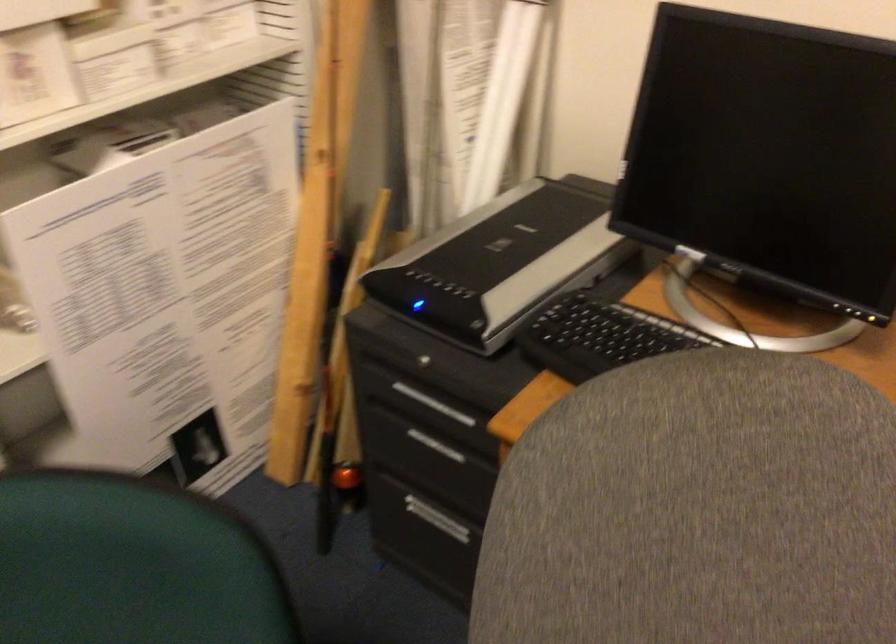
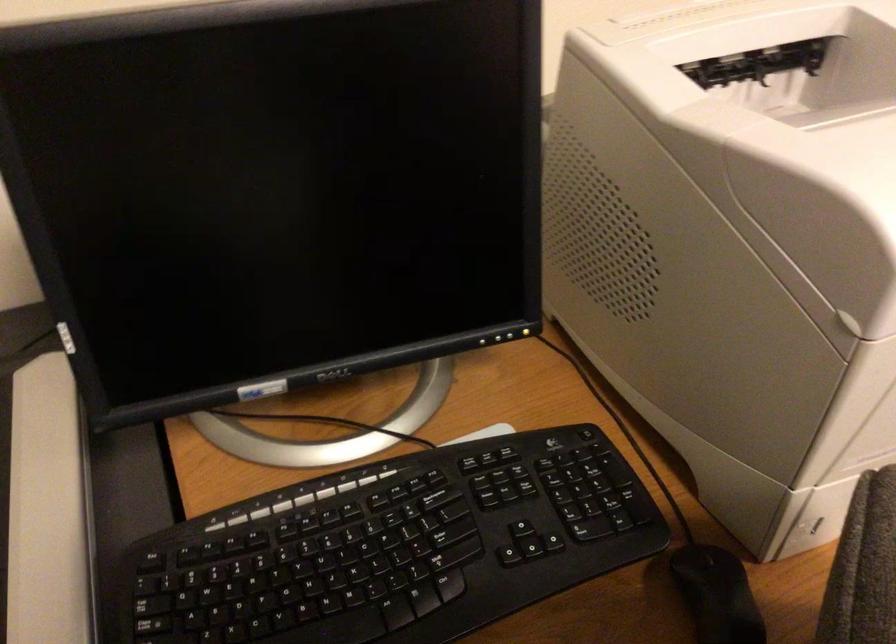
First-person continuous shooting, in which direction is the camera rotating?

The rotation direction of the camera is right-down.